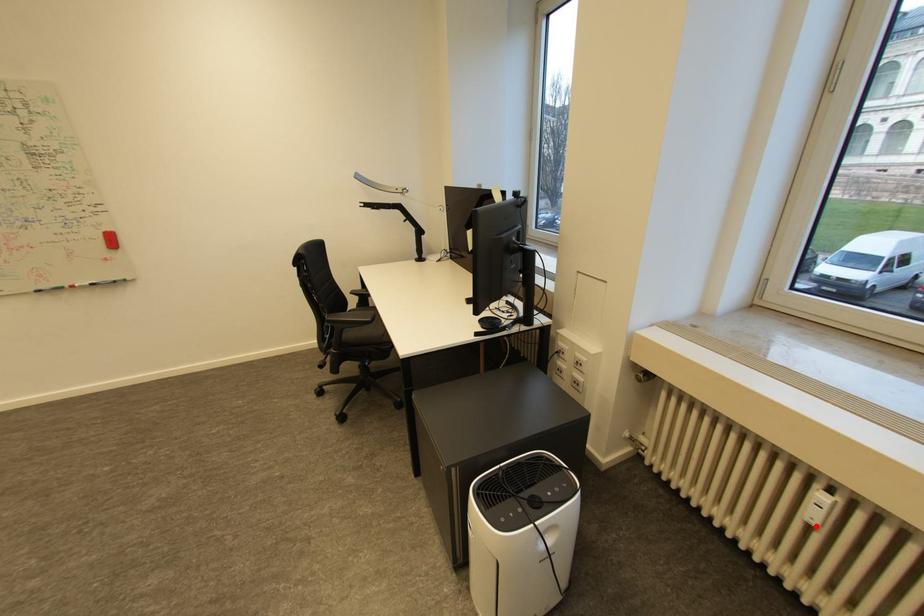
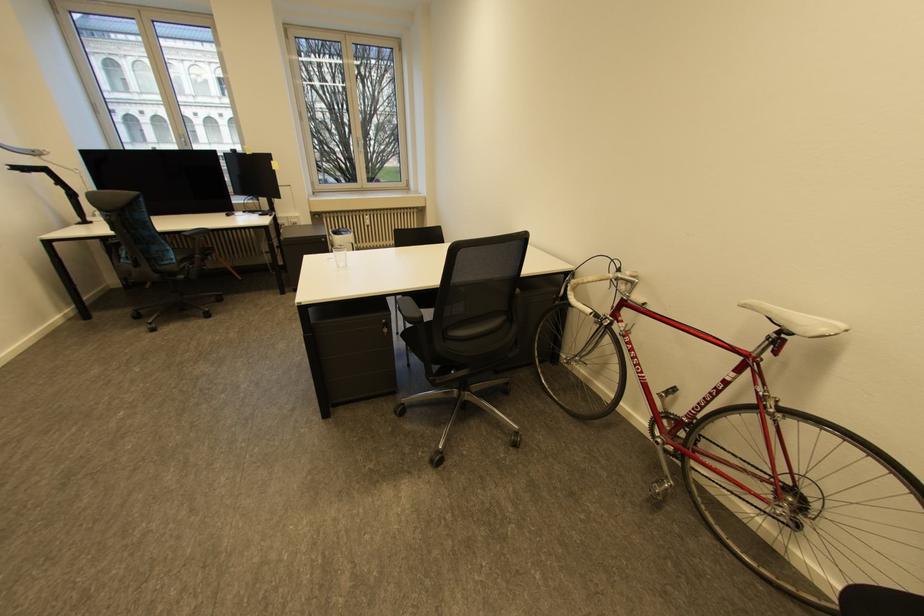
Question: I am providing you with two images of the same scene from different viewpoints. In image1, a red point is highlighted. Considering the same 3D point in image2, which of the following is correct?

Choices:
 (A) It is closer
 (B) It is farther

Answer: (B)